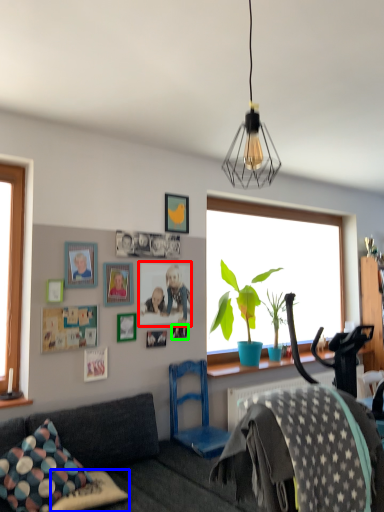
Question: Which object is positioned farthest from picture frame (highlighted by a red box)? Select from pillow (highlighted by a blue box) and picture frame (highlighted by a green box).

Choices:
 (A) pillow
 (B) picture frame

Answer: (A)